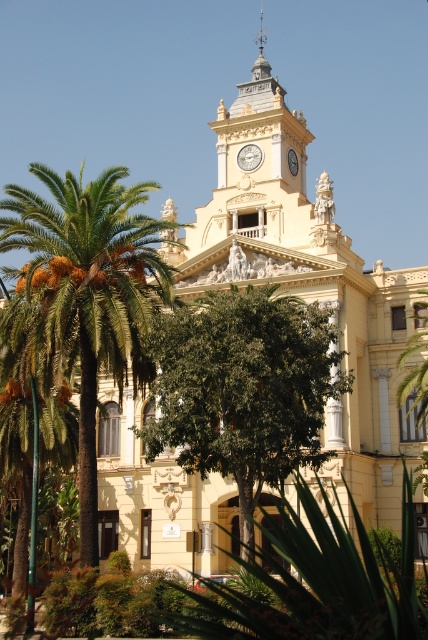
You are a visitor standing in front of the grand building. You notice the green leafy tree at center and the white glossy clock at upper center. Which object is taller?

The green leafy tree at center is much taller than the white glossy clock at upper center.

You are a visitor standing in front of the grand building and want to take a photo that includes both the green leafy palm tree at left and the white glossy clock at upper center. Which object will appear larger in the photo?

The green leafy palm tree at left will appear larger in the photo because it is bigger than the white glossy clock at upper center.

You are standing in front of the grand building and want to take a photo that includes both the green leafy tree at center and the green leafy palm tree at left. However, you notice that one of them is blocking the other. Which tree is blocking the other?

The green leafy tree at center is in front of the green leafy palm tree at left, so the green leafy tree at center is blocking the green leafy palm tree at left.